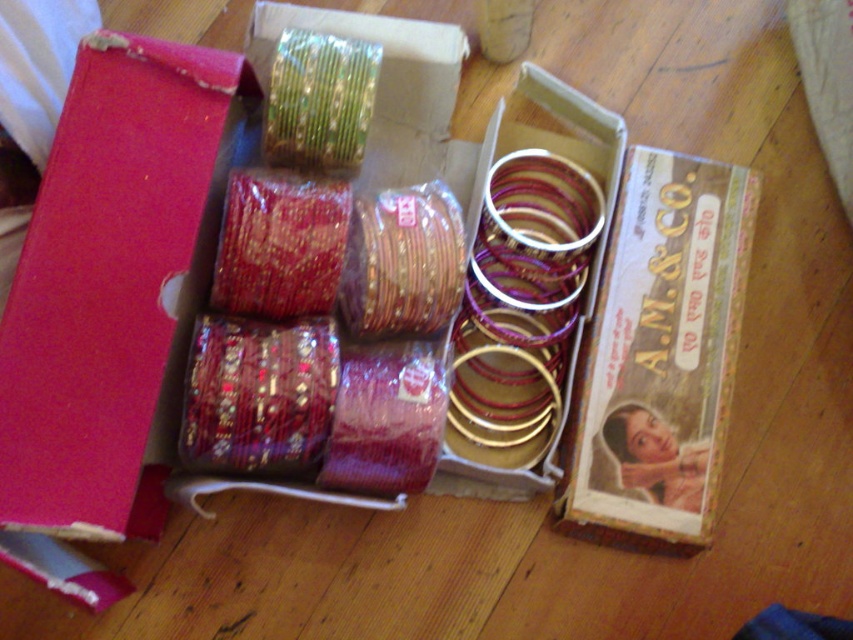
You are standing in front of the wooden surface with the two boxes of bangles. You want to pick up the bangle at point (286, 339) and the one at point (357, 54). Which bangle will require you to bend down less to reach?

The bangle at point (286, 339) is closer to the camera, so you will need to bend down less to reach it compared to the one at point (357, 54).

In the scene shown: You are organizing a jewelry display and need to place the shiny purple elastic band at center and the shiny metallic bangles at center into a narrow drawer. Which object should you place first to ensure both fit?

The shiny metallic bangles at center are narrower than the shiny purple elastic band at center, so you should place the wider shiny purple elastic band at center first to make space for the narrower metallic bangles.

You are organizing the bangles in the image. You need to place the shiny purple elastic band at center and the shiny metallic bangles at center into a new display. Which object should you place first if you want to maintain their original left to right order?

The shiny purple elastic band at center should be placed first because it is to the left of the shiny metallic bangles at center in the original arrangement.